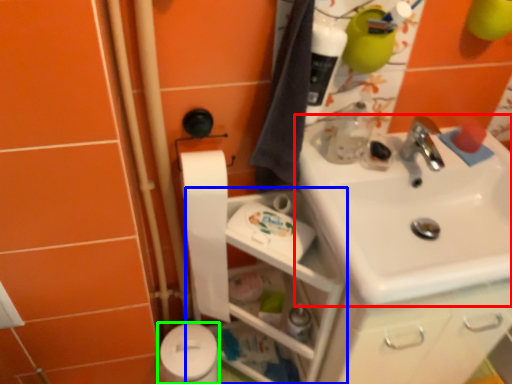
Question: Which object is the farthest from sink (highlighted by a red box)? Choose among these: shelf (highlighted by a blue box) or toilet paper (highlighted by a green box).

Choices:
 (A) shelf
 (B) toilet paper

Answer: (B)